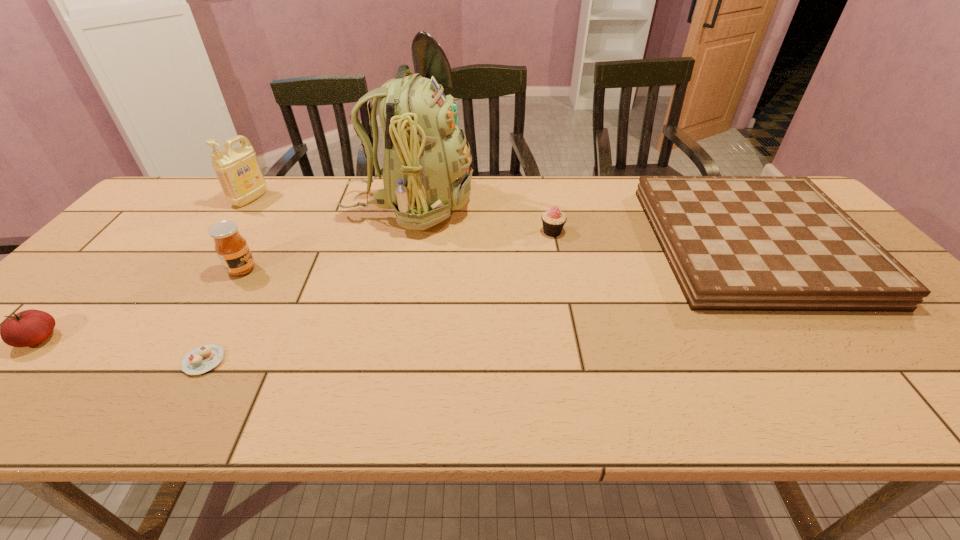
Where is `the nearer cupcake`? This screenshot has height=540, width=960. the nearer cupcake is located at coordinates (203, 358).

The width and height of the screenshot is (960, 540). Identify the location of the shortest object. (203, 358).

Find the location of a particular element. free space located on the front-facing side of the tallest object is located at coordinates (576, 205).

Identify the location of vacant space situated on the front of the second object from left to right. Image resolution: width=960 pixels, height=540 pixels. (235, 219).

This screenshot has width=960, height=540. In order to click on vacant position located on the front-facing side of the third tallest object in this screenshot , I will do `click(337, 270)`.

You are a GUI agent. You are given a task and a screenshot of the screen. Output one action in this format:
    pyautogui.click(x=<x>, y=<y>)
    Task: Click on the vacant region located on the front of the right cupcake
    The image size is (960, 540).
    Given the screenshot: What is the action you would take?
    pyautogui.click(x=571, y=324)

The height and width of the screenshot is (540, 960). Identify the location of vacant space located on the back of the leftmost object. (145, 229).

You are a GUI agent. You are given a task and a screenshot of the screen. Output one action in this format:
    pyautogui.click(x=<x>, y=<y>)
    Task: Click on the blank area located 0.130m on the front of the sixth tallest object
    Image resolution: width=960 pixels, height=540 pixels.
    Given the screenshot: What is the action you would take?
    pyautogui.click(x=836, y=356)

The width and height of the screenshot is (960, 540). In order to click on free space located on the back of the nearer cupcake in this screenshot , I will do pyautogui.click(x=260, y=262).

Where is `backpack that is positioned at the far edge`? The height and width of the screenshot is (540, 960). backpack that is positioned at the far edge is located at coordinates (426, 174).